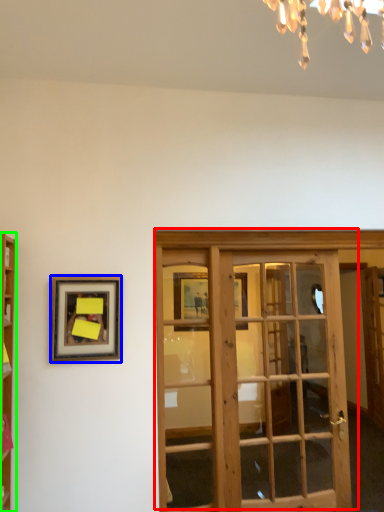
Question: Estimate the real-world distances between objects in this image. Which object is farther from door (highlighted by a red box), picture frame (highlighted by a blue box) or cabinetry (highlighted by a green box)?

Choices:
 (A) picture frame
 (B) cabinetry

Answer: (B)